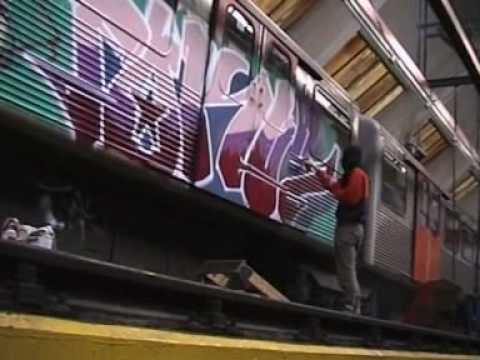
Identify the location of fluorescent light reflection in glass. (240, 17).